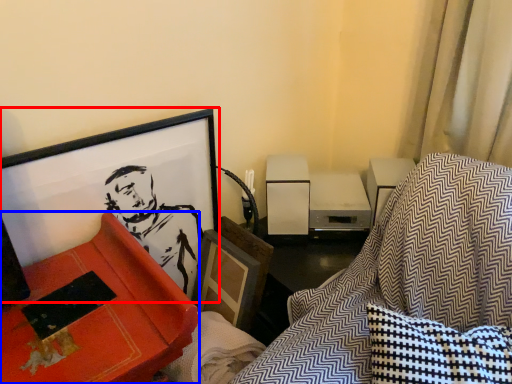
Question: Among these objects, which one is farthest to the camera, picture frame (highlighted by a red box) or furniture (highlighted by a blue box)?

Choices:
 (A) picture frame
 (B) furniture

Answer: (A)